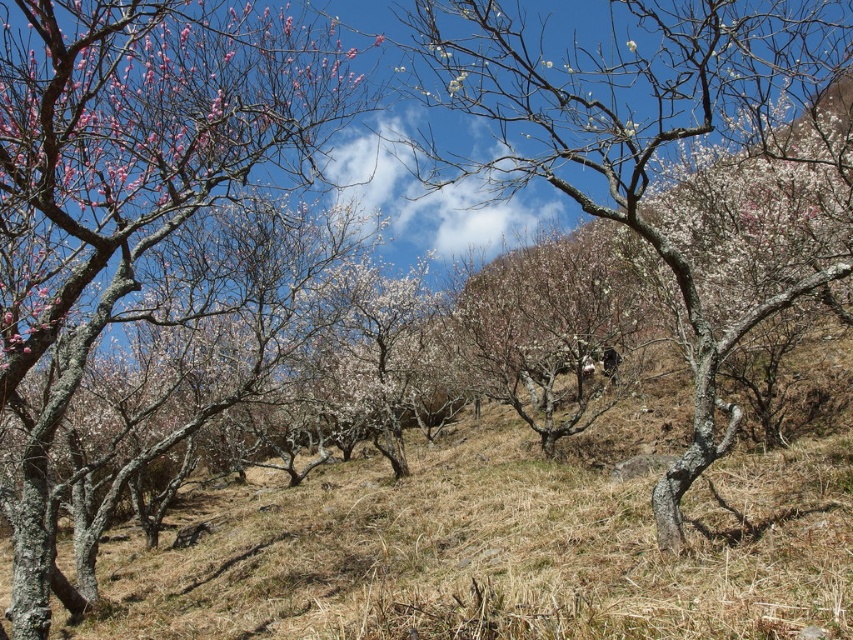
You are standing at the center of the grove and see two points marked in the scene. The first point is at coordinates point [4,44] and the second point is at point [624,1]. Which point is closer to you?

Point [4,44] is closer to you because it is in front of point [624,1].

You are a hiker who wants to take a photo of the smooth bark tree at left and the white textured tree at center. Since you have a wide angle lens, you want to capture both trees in the same frame. Which tree should you position closer to the center of the frame to ensure both are fully visible?

You should position the white textured tree at center closer to the center of the frame because the smooth bark tree at left is larger in size and will require more space in the frame to be fully visible.